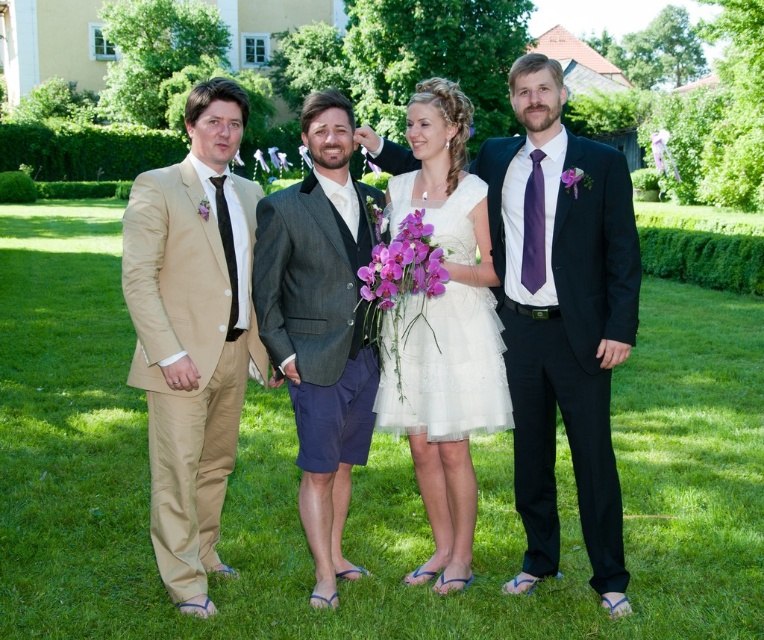
Does point (583, 548) come behind point (316, 252)?

Yes, it is behind point (316, 252).

Locate an element on the screen. The height and width of the screenshot is (640, 764). green grass at center is located at coordinates (358, 480).

Between beige satin suit at left and gray textured blazer at center, which one has more height?

With more height is beige satin suit at left.

Does point (219, 291) come behind point (332, 177)?

That is False.

Does point (248, 340) come farther from viewer compared to point (274, 250)?

Yes, point (248, 340) is farther from viewer.

You are a GUI agent. You are given a task and a screenshot of the screen. Output one action in this format:
    pyautogui.click(x=<x>, y=<y>)
    Task: Click on the beige satin suit at left
    
    Given the screenshot: What is the action you would take?
    pyautogui.click(x=193, y=332)

Does matte black suit at right lie in front of white tulle dress at center?

Yes.

Is matte black suit at right further to camera compared to white tulle dress at center?

No, it is not.

Does point (491, 164) come farther from viewer compared to point (423, 429)?

Yes, point (491, 164) is farther from viewer.

Image resolution: width=764 pixels, height=640 pixels. What are the coordinates of `matte black suit at right` in the screenshot? It's located at (562, 317).